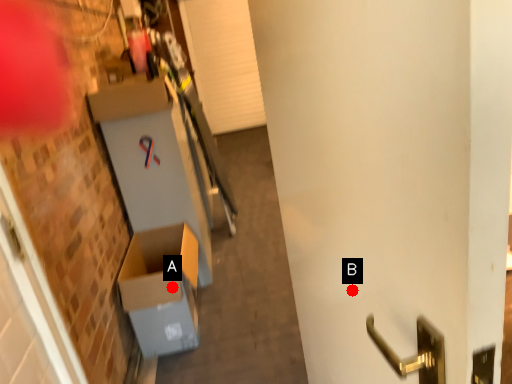
Question: Two points are circled on the image, labeled by A and B beside each circle. Which point is closer to the camera?

Choices:
 (A) A is closer
 (B) B is closer

Answer: (B)